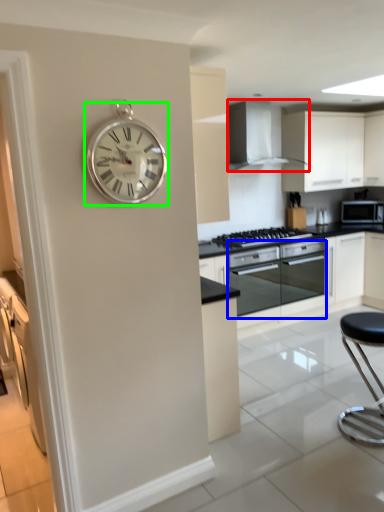
Question: Considering the real-world distances, which object is closest to home appliance (highlighted by a red box)? oven (highlighted by a blue box) or wall clock (highlighted by a green box).

Choices:
 (A) oven
 (B) wall clock

Answer: (A)